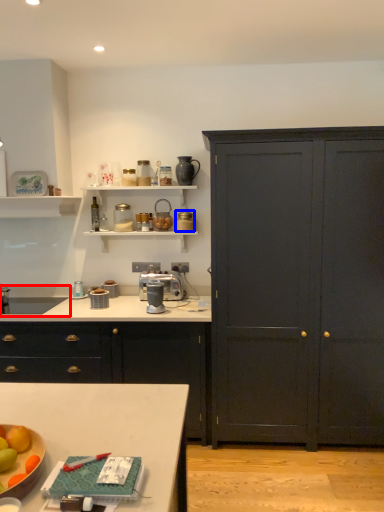
Question: Among these objects, which one is nearest to the camera, sink (highlighted by a red box) or appliance (highlighted by a blue box)?

Choices:
 (A) sink
 (B) appliance

Answer: (A)